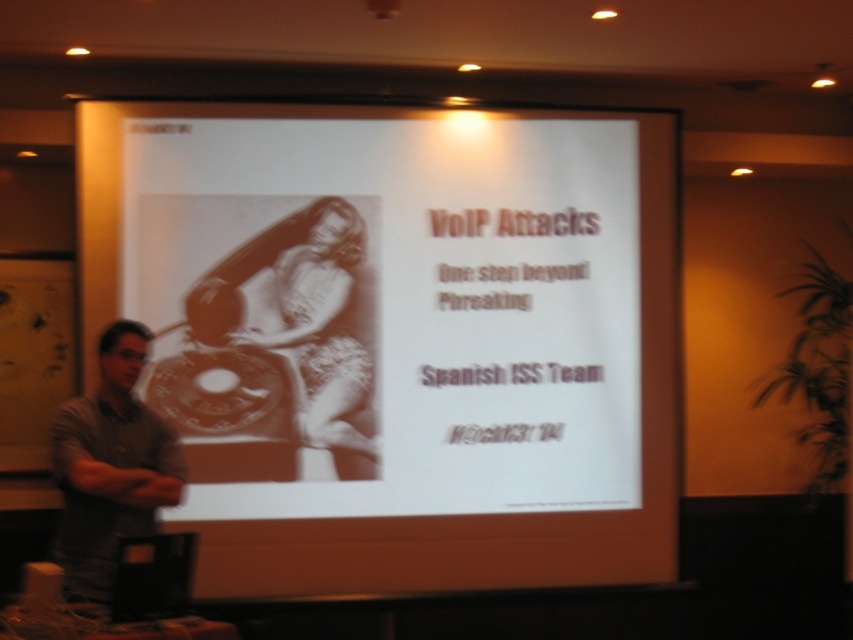
You are an attendee at this presentation and you want to take notes. Where should you look to find the white paper at center?

The white paper at center is located at point [398,337].

You are sitting in the audience and want to hand a note to the presenter. The presenter is wearing the gray casual shirt at left. You have a white paper at center on your seat. Which item is closer to you?

The white paper at center is closer to you since it is further to the viewer than the gray casual shirt at left, meaning it is positioned nearer in your line of sight.